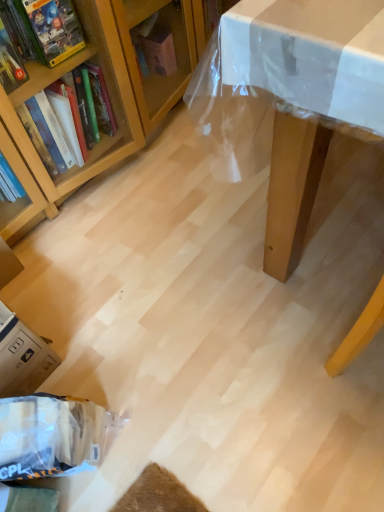
Describe the element at coordinates (52, 435) in the screenshot. This screenshot has width=384, height=512. I see `translucent plastic bag at lower left` at that location.

You are a GUI agent. You are given a task and a screenshot of the screen. Output one action in this format:
    pyautogui.click(x=<x>, y=<y>)
    Task: Click on the translucent plastic bag at lower left
    Image resolution: width=384 pixels, height=512 pixels.
    Given the screenshot: What is the action you would take?
    pyautogui.click(x=52, y=435)

Locate an element on the screen. translucent plastic bag at lower left is located at coordinates (52, 435).